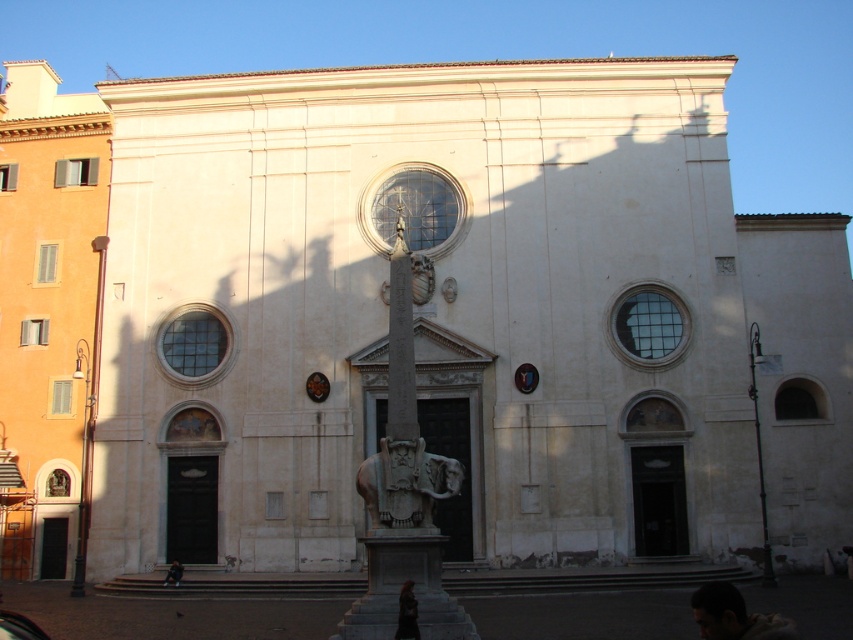
Question: Which object is positioned farthest from the dark hair human head at lower right?

Choices:
 (A) dark hair at center
 (B) dark hair human at lower center
 (C) beige stone church at left
 (D) carved stone elephant at center

Answer: (C)

Question: Is beige stone church at left to the left of carved stone elephant at center from the viewer's perspective?

Choices:
 (A) no
 (B) yes

Answer: (B)

Question: Can you confirm if dark hair human head at lower right is positioned above dark hair at center?

Choices:
 (A) no
 (B) yes

Answer: (A)

Question: Does carved stone elephant at center have a larger size compared to dark hair human head at lower right?

Choices:
 (A) no
 (B) yes

Answer: (A)

Question: Considering the real-world distances, which object is farthest from the beige stone church at left?

Choices:
 (A) dark hair at center
 (B) dark hair human head at lower right
 (C) carved stone elephant at center

Answer: (B)

Question: Which point appears closest to the camera in this image?

Choices:
 (A) (405, 596)
 (B) (64, 499)
 (C) (177, 582)

Answer: (A)